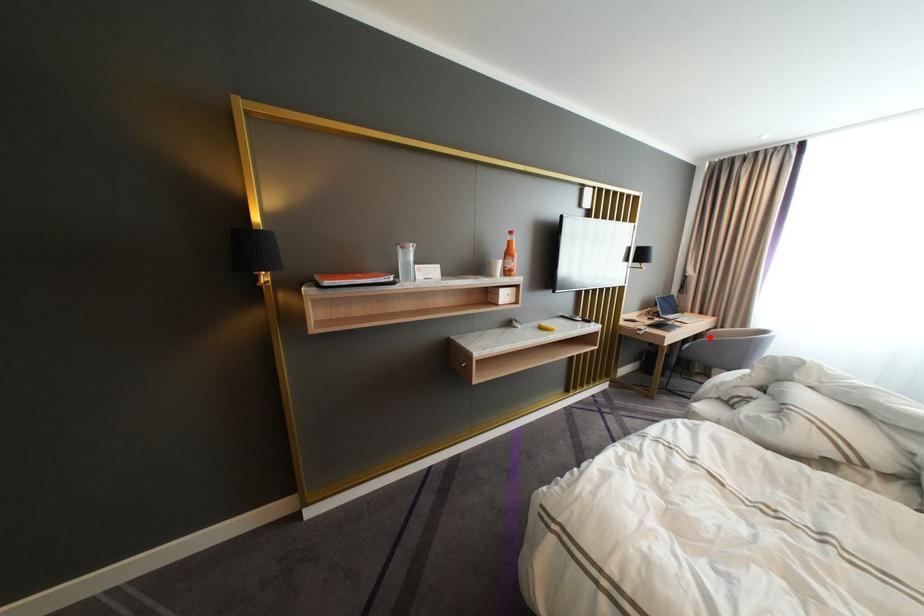
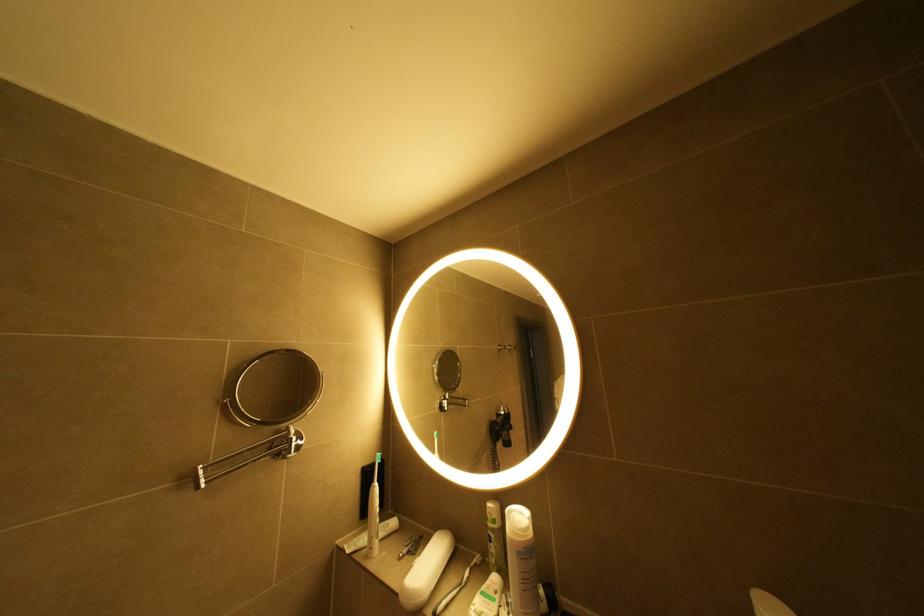
Question: I am providing you with two images of the same scene from different viewpoints. A red point is marked on the first image. At the location where the point appears in image 1, is it still visible in image 2?

Choices:
 (A) Yes
 (B) No

Answer: (B)